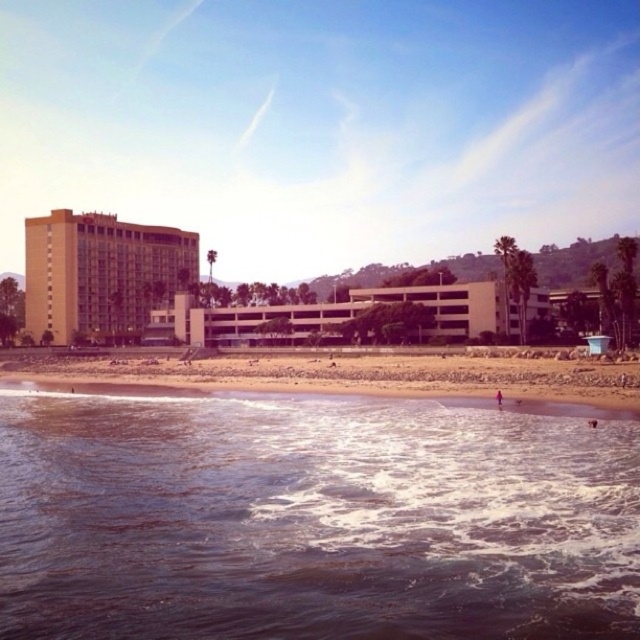
Is brown water at lower left wider than beige concrete parking garage at center?

Incorrect, brown water at lower left's width does not surpass beige concrete parking garage at center's.

Who is higher up, brown water at lower left or beige concrete parking garage at center?

beige concrete parking garage at center is above.

Image resolution: width=640 pixels, height=640 pixels. What do you see at coordinates (312, 518) in the screenshot? I see `brown water at lower left` at bounding box center [312, 518].

This screenshot has width=640, height=640. I want to click on brown water at lower left, so click(x=312, y=518).

Which is more to the right, beige concrete building at left or beige concrete parking garage at center?

beige concrete parking garage at center is more to the right.

Measure the distance between beige concrete building at left and camera.

beige concrete building at left is 123.86 meters away from camera.

Find the location of a particular element. Image resolution: width=640 pixels, height=640 pixels. beige concrete building at left is located at coordinates pyautogui.click(x=100, y=275).

Can you confirm if brown water at lower left is taller than brown sand at lower center?

Incorrect, brown water at lower left's height is not larger of brown sand at lower center's.

The width and height of the screenshot is (640, 640). Describe the element at coordinates (312, 518) in the screenshot. I see `brown water at lower left` at that location.

Identify the location of brown water at lower left. (312, 518).